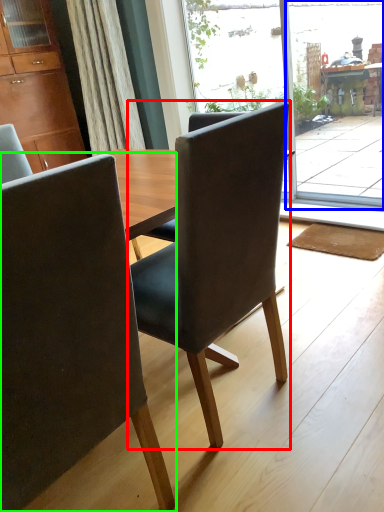
Question: Which object is positioned farthest from chair (highlighted by a red box)? Select from screen door (highlighted by a blue box) and chair (highlighted by a green box).

Choices:
 (A) screen door
 (B) chair

Answer: (A)